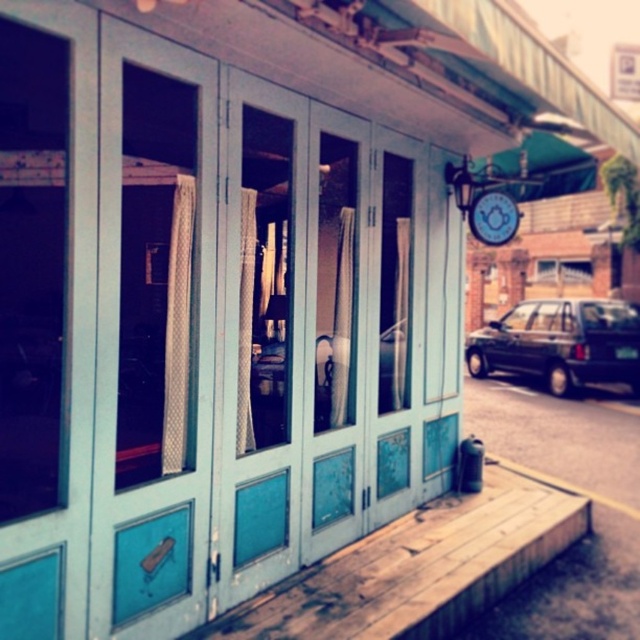
Between point (534, 336) and point (483, 216), which one is positioned behind?

The point (534, 336) is more distant.

Describe the element at coordinates (561, 342) in the screenshot. The width and height of the screenshot is (640, 640). I see `dark green matte van at right` at that location.

You are a GUI agent. You are given a task and a screenshot of the screen. Output one action in this format:
    pyautogui.click(x=<x>, y=<y>)
    Task: Click on the dark green matte van at right
    This screenshot has height=640, width=640.
    Given the screenshot: What is the action you would take?
    pyautogui.click(x=561, y=342)

Is point (124, 444) positioned before point (493, 221)?

Yes, it is in front of point (493, 221).

Who is more distant from viewer, (145, 426) or (480, 204)?

Point (145, 426)

This screenshot has width=640, height=640. In order to click on translucent glass screen door at left in this screenshot , I will do `click(152, 336)`.

Does transparent glass door at left lie behind matte blue clock at upper center?

That is True.

Is point (28, 429) positioned in front of point (472, 220)?

Yes, it is.

Who is more forward, (33, 296) or (474, 209)?

Point (474, 209)

Identify the location of transparent glass door at left. (33, 266).